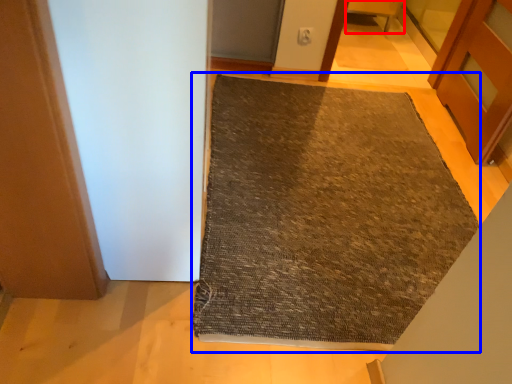
Question: Which object is closer to the camera taking this photo, furniture (highlighted by a red box) or mat (highlighted by a blue box)?

Choices:
 (A) furniture
 (B) mat

Answer: (B)